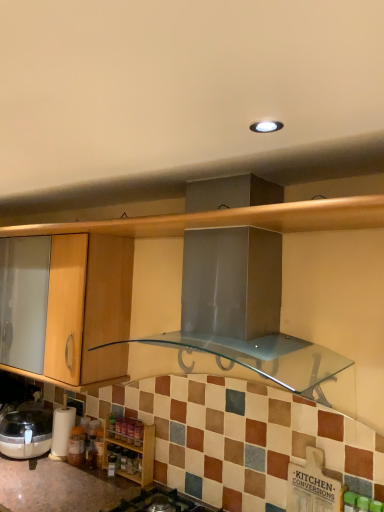
Question: Considering the positions of point (59, 426) and point (107, 464), is point (59, 426) closer or farther from the camera than point (107, 464)?

Choices:
 (A) farther
 (B) closer

Answer: (A)

Question: From the image's perspective, relative to wooden spice rack at lower left, is white paper towel holder at lower left above or below?

Choices:
 (A) above
 (B) below

Answer: (A)

Question: Which object is the closest to the white paper towel holder at lower left?

Choices:
 (A) black glass gas stove at lower center
 (B) wooden spice rack at lower left

Answer: (B)

Question: Which object is positioned farthest from the white paper towel holder at lower left?

Choices:
 (A) black glass gas stove at lower center
 (B) wooden spice rack at lower left

Answer: (A)